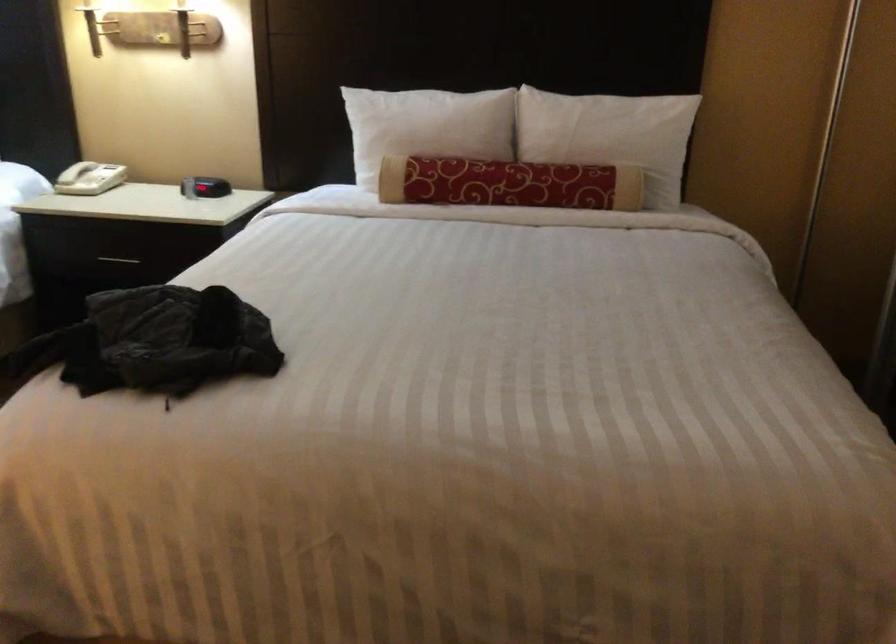
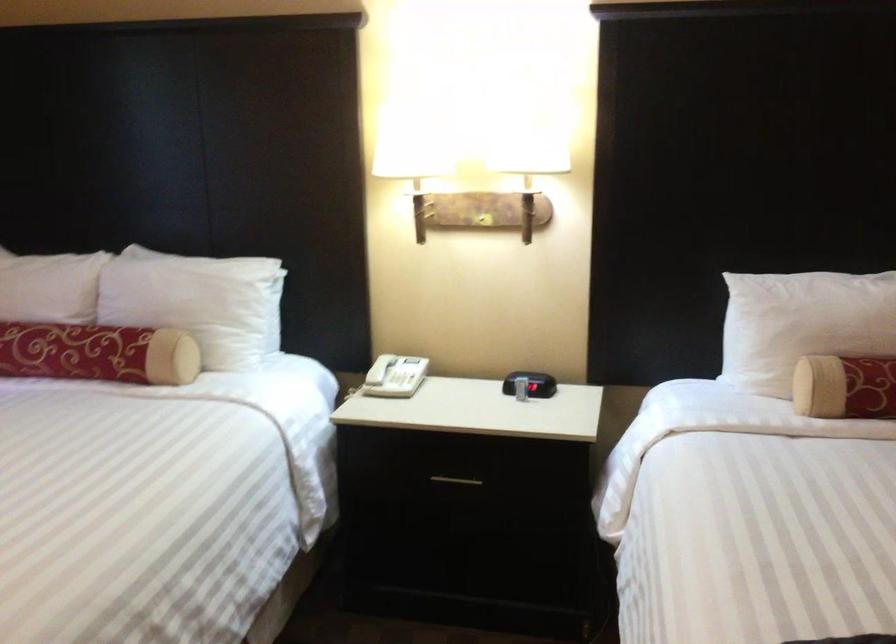
In the second image, find the point that corresponds to point 71,167 in the first image.

(380, 368)